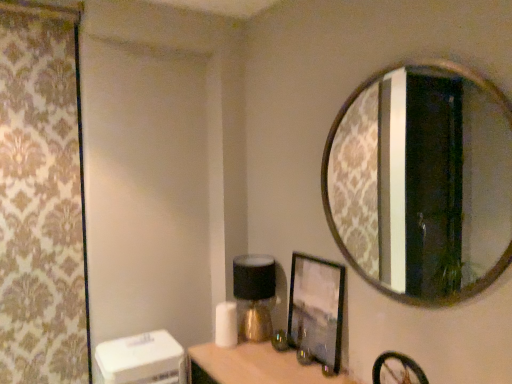
This screenshot has height=384, width=512. Identify the location of empty space that is ontop of patterned fabric curtain at left (from a real-world perspective). (32, 4).